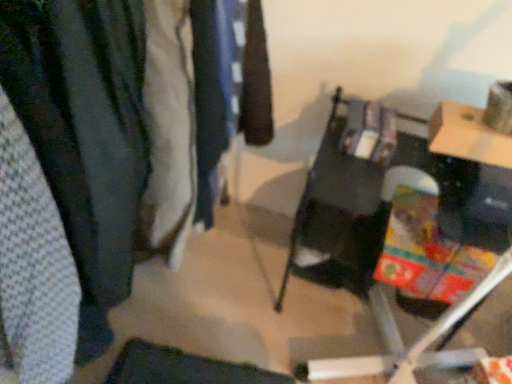
Question: Considering the positions of matte black table at center and dark blue fabric at center, arranged as the second clothing when viewed from the left, in the image, is matte black table at center bigger or smaller than dark blue fabric at center, arranged as the second clothing when viewed from the left,?

Choices:
 (A) small
 (B) big

Answer: (B)

Question: Looking at their shapes, would you say matte black table at center is wider or thinner than dark blue fabric at center, acting as the 1th clothing starting from the right?

Choices:
 (A) wide
 (B) thin

Answer: (A)

Question: Which is nearer to the white textured fabric at left, which is the 1th clothing in front-to-back order?

Choices:
 (A) dark blue fabric at center, which ranks as the second clothing in front-to-back order
 (B) textured fabric closet at left
 (C) matte black table at center

Answer: (B)

Question: Considering the real-world distances, which object is closest to the textured fabric closet at left?

Choices:
 (A) dark blue fabric at center, which ranks as the second clothing in front-to-back order
 (B) matte black table at center
 (C) white textured fabric at left, the first clothing viewed from the left

Answer: (C)